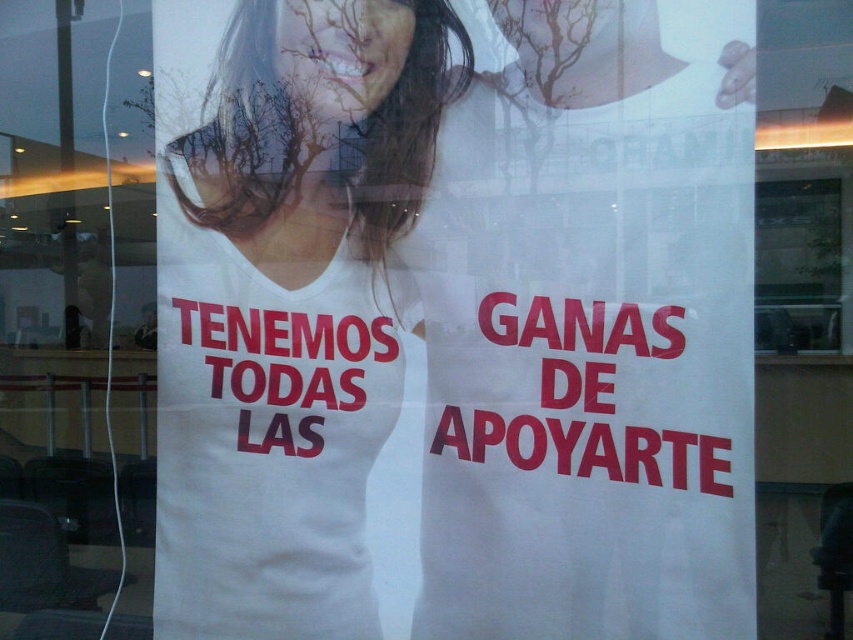
Can you confirm if white matte t-shirt at center is positioned to the left of clear glass window at upper right?

Indeed, white matte t-shirt at center is positioned on the left side of clear glass window at upper right.

Between point (303, 412) and point (775, 212), which one is positioned behind?

Point (775, 212)

Find the location of `white matte t-shirt at center`. white matte t-shirt at center is located at coordinates (451, 321).